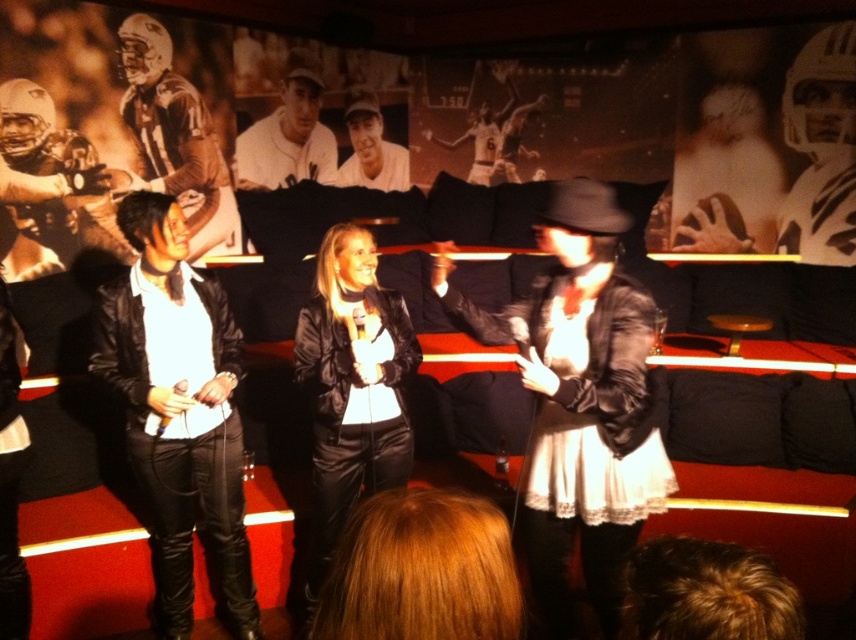
You are standing in the karaoke bar and need to locate the matte brown leather jacket at upper left. Based on the coordinates provided, can you determine its position relative to the center of the image?

The matte brown leather jacket at upper left is located at coordinates point (174,138), which places it closer to the upper left corner of the image compared to the center.

You are a photographer trying to capture a clear shot of both the white lace dress at center and the white jersey at center. Since they are both white, you need to adjust your camera settings to ensure proper exposure. Which object should you focus on first to avoid overexposure?

The white lace dress at center is positioned under the white jersey at center, so focusing on the white jersey at center first would help avoid overexposure as it is likely receiving more light.